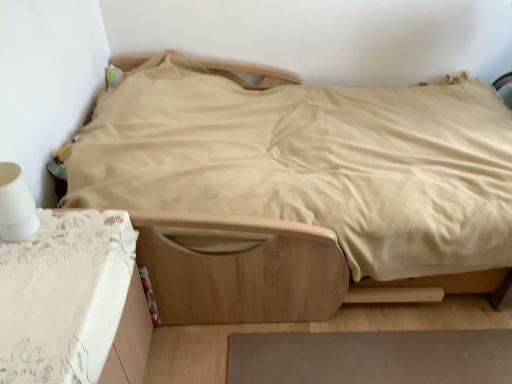
Question: Based on their positions, is white lace tablecloth at lower left located to the left or right of white matte table lamp at left?

Choices:
 (A) right
 (B) left

Answer: (A)

Question: Is white lace tablecloth at lower left inside the boundaries of white matte table lamp at left, or outside?

Choices:
 (A) inside
 (B) outside

Answer: (B)

Question: Which object is the farthest from the light brown wooden bed at center?

Choices:
 (A) white lace tablecloth at lower left
 (B) brown matte rug at lower center
 (C) white matte table lamp at left

Answer: (C)

Question: Which of these objects is positioned closest to the white lace tablecloth at lower left?

Choices:
 (A) light brown wooden bed at center
 (B) brown matte rug at lower center
 (C) white matte table lamp at left

Answer: (C)